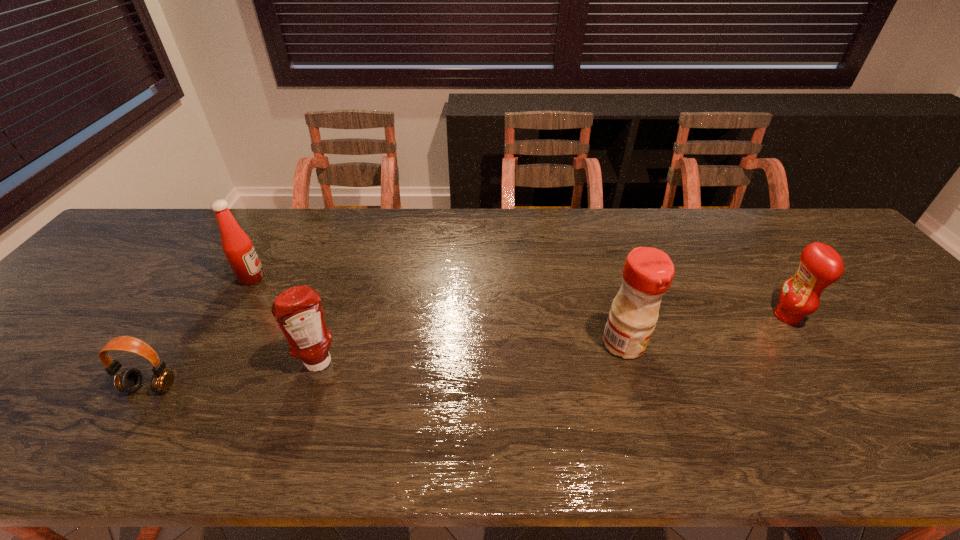
Find the location of a particular element. The image size is (960, 540). vacant space that's between the rightmost condiment and the headset is located at coordinates (468, 352).

Locate an element on the screen. free point between the third condiment from right to left and the rightmost condiment is located at coordinates (553, 340).

Find the location of `blank region between the rightmost object and the shortest object`. blank region between the rightmost object and the shortest object is located at coordinates (468, 352).

Find the location of a particular element. The width and height of the screenshot is (960, 540). empty location between the second condiment from right to left and the third condiment from right to left is located at coordinates (472, 354).

Locate an element on the screen. vacant region between the rightmost object and the third condiment from right to left is located at coordinates (553, 340).

What are the coordinates of `vacant region between the rightmost object and the second object from right to left` in the screenshot? It's located at (706, 330).

The height and width of the screenshot is (540, 960). Find the location of `object that stands as the closest to the second object from right to left`. object that stands as the closest to the second object from right to left is located at coordinates (820, 265).

Identify which object is the fourth closest to the farthest condiment. Please provide its 2D coordinates. Your answer should be formatted as a tuple, i.e. [(x, y)], where the tuple contains the x and y coordinates of a point satisfying the conditions above.

[(820, 265)]

You are a GUI agent. You are given a task and a screenshot of the screen. Output one action in this format:
    pyautogui.click(x=<x>, y=<y>)
    Task: Click on the condiment that can be found as the third closest to the second object from right to left
    The width and height of the screenshot is (960, 540).
    Given the screenshot: What is the action you would take?
    pyautogui.click(x=237, y=246)

Choose which condiment is the third nearest neighbor to the third object from right to left. Please provide its 2D coordinates. Your answer should be formatted as a tuple, i.e. [(x, y)], where the tuple contains the x and y coordinates of a point satisfying the conditions above.

[(820, 265)]